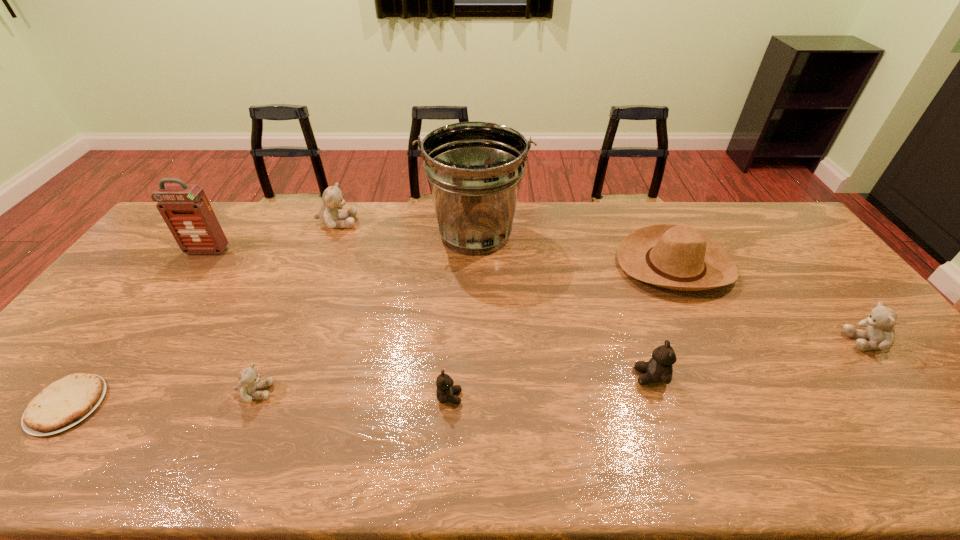
At what (x,y) coordinates should I click in order to perform the action: click on bucket. Please return your answer as a coordinate pair (x, y). This screenshot has height=540, width=960. Looking at the image, I should click on (474, 169).

This screenshot has height=540, width=960. In order to click on the second tallest object in this screenshot , I will do `click(185, 208)`.

Image resolution: width=960 pixels, height=540 pixels. Identify the location of the first-aid kit. (185, 208).

Where is `the farthest teddy bear`? the farthest teddy bear is located at coordinates (329, 215).

Find the location of a particular element. Image resolution: width=960 pixels, height=540 pixels. the tallest teddy bear is located at coordinates (329, 215).

Locate an element on the screen. This screenshot has height=540, width=960. cowboy hat is located at coordinates pos(678,257).

Where is `the second teddy bear from right to left`? This screenshot has height=540, width=960. the second teddy bear from right to left is located at coordinates [659, 369].

At what (x,y) coordinates should I click in order to perform the action: click on the right brown teddy bear. Please return your answer as a coordinate pair (x, y). The image size is (960, 540). Looking at the image, I should click on (659, 369).

At what (x,y) coordinates should I click in order to perform the action: click on the rightmost teddy bear. Please return your answer as a coordinate pair (x, y). The width and height of the screenshot is (960, 540). Looking at the image, I should click on (880, 332).

In order to click on the second farthest teddy bear in this screenshot , I will do `click(880, 332)`.